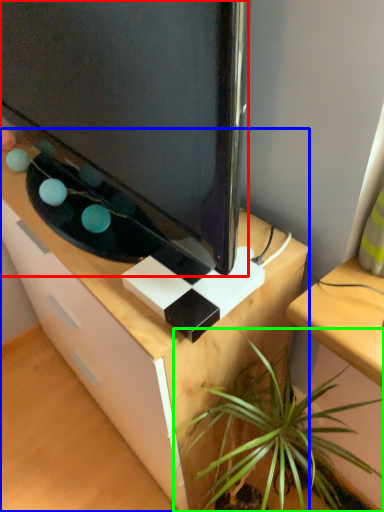
Question: Which object is positioned farthest from television (highlighted by a red box)? Select from desk (highlighted by a blue box) and houseplant (highlighted by a green box).

Choices:
 (A) desk
 (B) houseplant

Answer: (B)